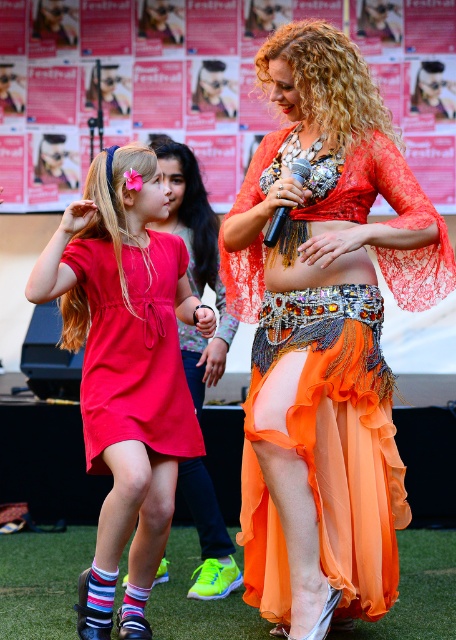
Question: Is matte red dress at center below black metallic microphone at center?

Choices:
 (A) no
 (B) yes

Answer: (B)

Question: Can you confirm if matte red dress at center is positioned above matte red dress at left?

Choices:
 (A) no
 (B) yes

Answer: (A)

Question: Which of the following is the farthest from the observer?

Choices:
 (A) (269, 241)
 (B) (330, 227)
 (C) (98, 337)
 (D) (238, 566)

Answer: (D)

Question: Which of the following is the farthest from the observer?

Choices:
 (A) (213, 340)
 (B) (102, 292)
 (C) (278, 216)

Answer: (A)

Question: Which object is positioned closest to the matte red dress at center?

Choices:
 (A) black metallic microphone at center
 (B) shiny orange fabric at center
 (C) orange chiffon dress at center

Answer: (B)

Question: Is matte red dress at left bigger than black metallic microphone at center?

Choices:
 (A) no
 (B) yes

Answer: (B)